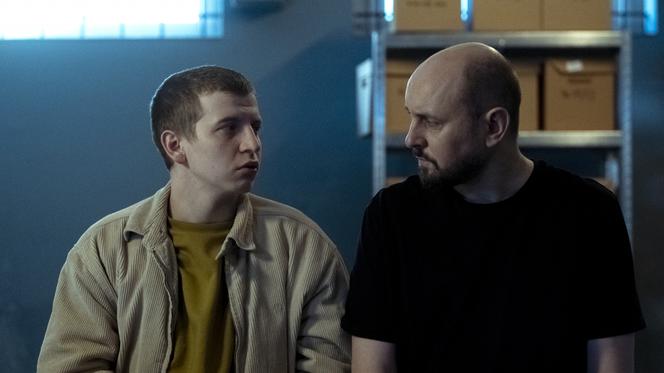
Where is `boxes`? This screenshot has width=664, height=373. boxes is located at coordinates (432, 20), (485, 14), (582, 16), (394, 95), (524, 94), (548, 101).